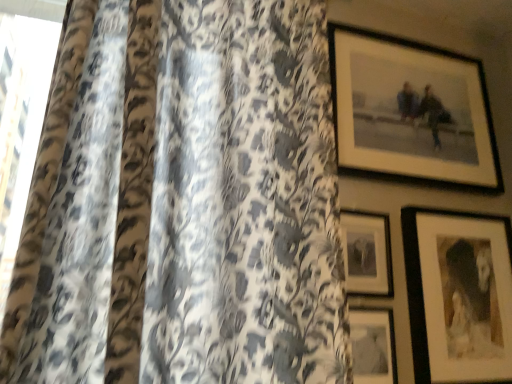
Identify the location of matte black picture frame at center, positioned as the third picture frame in bottom-to-top order. The image size is (512, 384). (367, 253).

From a real-world perspective, who is located lower, leopard print fabric at left or matte black picture frame at lower right, arranged as the 3th picture frame when viewed from the top?

From a 3D spatial view, matte black picture frame at lower right, arranged as the 3th picture frame when viewed from the top, is below.

Considering the positions of objects leopard print fabric at left and matte black picture frame at lower right, which is the 2th picture frame from bottom to top, in the image provided, who is more to the right, leopard print fabric at left or matte black picture frame at lower right, which is the 2th picture frame from bottom to top,?

matte black picture frame at lower right, which is the 2th picture frame from bottom to top.

Considering the sizes of objects leopard print fabric at left and matte black picture frame at lower right, arranged as the 3th picture frame when viewed from the top, in the image provided, who is smaller, leopard print fabric at left or matte black picture frame at lower right, arranged as the 3th picture frame when viewed from the top,?

matte black picture frame at lower right, arranged as the 3th picture frame when viewed from the top, is smaller.

Can you confirm if matte black picture frame at upper right, marked as the 4th picture frame in a bottom-to-top arrangement, is bigger than matte black picture frame at center, positioned as the third picture frame in bottom-to-top order?

Indeed, matte black picture frame at upper right, marked as the 4th picture frame in a bottom-to-top arrangement, has a larger size compared to matte black picture frame at center, positioned as the third picture frame in bottom-to-top order.

How many degrees apart are the facing directions of matte black picture frame at upper right, marked as the 4th picture frame in a bottom-to-top arrangement, and matte black picture frame at center, placed as the 2th picture frame when sorted from top to bottom?

The angle between the facing direction of matte black picture frame at upper right, marked as the 4th picture frame in a bottom-to-top arrangement, and the facing direction of matte black picture frame at center, placed as the 2th picture frame when sorted from top to bottom, is 4.52 degrees.

From the picture: Is matte black picture frame at upper right, marked as the 4th picture frame in a bottom-to-top arrangement, surrounding matte black picture frame at center, positioned as the third picture frame in bottom-to-top order?

No.

Is point (455, 158) positioned before point (377, 233)?

No, it is behind (377, 233).

Considering the sizes of objects matte black picture frame at lower center, positioned as the 4th picture frame in top-to-bottom order, and matte black picture frame at center, placed as the 2th picture frame when sorted from top to bottom, in the image provided, who is bigger, matte black picture frame at lower center, positioned as the 4th picture frame in top-to-bottom order, or matte black picture frame at center, placed as the 2th picture frame when sorted from top to bottom,?

Bigger between the two is matte black picture frame at center, placed as the 2th picture frame when sorted from top to bottom.

Is point (375, 324) positioned in front of point (361, 286)?

That is True.

Is matte black picture frame at center, placed as the 2th picture frame when sorted from top to bottom, surrounded by matte black picture frame at lower center, the 1th picture frame when ordered from bottom to top?

No, matte black picture frame at center, placed as the 2th picture frame when sorted from top to bottom, is not a part of matte black picture frame at lower center, the 1th picture frame when ordered from bottom to top.

Can you confirm if matte black picture frame at lower center, positioned as the 4th picture frame in top-to-bottom order, is positioned to the left of matte black picture frame at center, positioned as the third picture frame in bottom-to-top order?

Yes, matte black picture frame at lower center, positioned as the 4th picture frame in top-to-bottom order, is to the left of matte black picture frame at center, positioned as the third picture frame in bottom-to-top order.

Relative to matte black picture frame at center, placed as the 2th picture frame when sorted from top to bottom, is matte black picture frame at lower right, arranged as the 3th picture frame when viewed from the top, in front or behind?

matte black picture frame at lower right, arranged as the 3th picture frame when viewed from the top, is positioned closer to the viewer than matte black picture frame at center, placed as the 2th picture frame when sorted from top to bottom.

Is matte black picture frame at center, placed as the 2th picture frame when sorted from top to bottom, surrounded by matte black picture frame at lower right, arranged as the 3th picture frame when viewed from the top?

Definitely not — matte black picture frame at center, placed as the 2th picture frame when sorted from top to bottom, is not inside matte black picture frame at lower right, arranged as the 3th picture frame when viewed from the top.

Is there a large distance between matte black picture frame at lower right, which is the 2th picture frame from bottom to top, and matte black picture frame at center, positioned as the third picture frame in bottom-to-top order?

No, matte black picture frame at lower right, which is the 2th picture frame from bottom to top, is in close proximity to matte black picture frame at center, positioned as the third picture frame in bottom-to-top order.

Would you say matte black picture frame at center, positioned as the third picture frame in bottom-to-top order, is to the left or to the right of matte black picture frame at lower right, which is the 2th picture frame from bottom to top, in the picture?

Clearly, matte black picture frame at center, positioned as the third picture frame in bottom-to-top order, is on the left of matte black picture frame at lower right, which is the 2th picture frame from bottom to top, in the image.

Does point (387, 275) appear closer or farther from the camera than point (429, 239)?

Point (387, 275).

From a real-world perspective, count 1st picture frames downward from the matte black picture frame at center, positioned as the third picture frame in bottom-to-top order, and point to it. Please provide its 2D coordinates.

[(459, 296)]

Is matte black picture frame at lower center, the 1th picture frame when ordered from bottom to top, far away from matte black picture frame at upper right, placed as the first picture frame when sorted from top to bottom?

Actually, matte black picture frame at lower center, the 1th picture frame when ordered from bottom to top, and matte black picture frame at upper right, placed as the first picture frame when sorted from top to bottom, are a little close together.

Would you say matte black picture frame at lower center, positioned as the 4th picture frame in top-to-bottom order, is to the left or to the right of matte black picture frame at upper right, marked as the 4th picture frame in a bottom-to-top arrangement, in the picture?

In the image, matte black picture frame at lower center, positioned as the 4th picture frame in top-to-bottom order, appears on the left side of matte black picture frame at upper right, marked as the 4th picture frame in a bottom-to-top arrangement.

Who is shorter, matte black picture frame at lower center, positioned as the 4th picture frame in top-to-bottom order, or matte black picture frame at upper right, marked as the 4th picture frame in a bottom-to-top arrangement?

matte black picture frame at lower center, positioned as the 4th picture frame in top-to-bottom order, is shorter.

Which object is closer to the camera taking this photo, matte black picture frame at lower center, the 1th picture frame when ordered from bottom to top, or matte black picture frame at upper right, placed as the first picture frame when sorted from top to bottom?

matte black picture frame at lower center, the 1th picture frame when ordered from bottom to top.

Considering the sizes of objects matte black picture frame at center, placed as the 2th picture frame when sorted from top to bottom, and matte black picture frame at upper right, placed as the first picture frame when sorted from top to bottom, in the image provided, who is taller, matte black picture frame at center, placed as the 2th picture frame when sorted from top to bottom, or matte black picture frame at upper right, placed as the first picture frame when sorted from top to bottom,?

With more height is matte black picture frame at upper right, placed as the first picture frame when sorted from top to bottom.

From the image's perspective, relative to matte black picture frame at upper right, marked as the 4th picture frame in a bottom-to-top arrangement, is matte black picture frame at center, positioned as the third picture frame in bottom-to-top order, above or below?

Clearly, from the image's perspective, matte black picture frame at center, positioned as the third picture frame in bottom-to-top order, is below matte black picture frame at upper right, marked as the 4th picture frame in a bottom-to-top arrangement.

Which picture frame is the 1st one when counting from the right side of the matte black picture frame at center, positioned as the third picture frame in bottom-to-top order? Please provide its 2D coordinates.

[(411, 110)]

Find the location of a particular element. curtain in front of the matte black picture frame at lower right, arranged as the 3th picture frame when viewed from the top is located at coordinates (183, 202).

Where is `picture frame that is above the matte black picture frame at center, placed as the 2th picture frame when sorted from top to bottom (from a real-world perspective)`? picture frame that is above the matte black picture frame at center, placed as the 2th picture frame when sorted from top to bottom (from a real-world perspective) is located at coordinates (411, 110).

Looking at the image, which one is located closer to matte black picture frame at lower right, arranged as the 3th picture frame when viewed from the top, leopard print fabric at left or matte black picture frame at upper right, marked as the 4th picture frame in a bottom-to-top arrangement?

Among the two, matte black picture frame at upper right, marked as the 4th picture frame in a bottom-to-top arrangement, is located nearer to matte black picture frame at lower right, arranged as the 3th picture frame when viewed from the top.

Considering their positions, is matte black picture frame at center, positioned as the third picture frame in bottom-to-top order, positioned further to matte black picture frame at lower right, which is the 2th picture frame from bottom to top, than matte black picture frame at upper right, marked as the 4th picture frame in a bottom-to-top arrangement?

Based on the image, matte black picture frame at upper right, marked as the 4th picture frame in a bottom-to-top arrangement, appears to be further to matte black picture frame at lower right, which is the 2th picture frame from bottom to top.

Based on their spatial positions, is matte black picture frame at lower center, positioned as the 4th picture frame in top-to-bottom order, or matte black picture frame at upper right, placed as the first picture frame when sorted from top to bottom, further from leopard print fabric at left?

matte black picture frame at lower center, positioned as the 4th picture frame in top-to-bottom order.

Estimate the real-world distances between objects in this image. Which object is further from matte black picture frame at center, placed as the 2th picture frame when sorted from top to bottom, matte black picture frame at lower right, which is the 2th picture frame from bottom to top, or leopard print fabric at left?

Based on the image, leopard print fabric at left appears to be further to matte black picture frame at center, placed as the 2th picture frame when sorted from top to bottom.

From the image, which object appears to be farther from leopard print fabric at left, matte black picture frame at center, positioned as the third picture frame in bottom-to-top order, or matte black picture frame at lower center, the 1th picture frame when ordered from bottom to top?

matte black picture frame at lower center, the 1th picture frame when ordered from bottom to top, is further to leopard print fabric at left.

In the scene shown: Based on their spatial positions, is matte black picture frame at lower right, arranged as the 3th picture frame when viewed from the top, or matte black picture frame at upper right, marked as the 4th picture frame in a bottom-to-top arrangement, closer to leopard print fabric at left?

The object closer to leopard print fabric at left is matte black picture frame at upper right, marked as the 4th picture frame in a bottom-to-top arrangement.

Considering their positions, is matte black picture frame at lower center, the 1th picture frame when ordered from bottom to top, positioned closer to matte black picture frame at upper right, marked as the 4th picture frame in a bottom-to-top arrangement, than leopard print fabric at left?

leopard print fabric at left.

Estimate the real-world distances between objects in this image. Which object is closer to matte black picture frame at lower right, which is the 2th picture frame from bottom to top, matte black picture frame at upper right, marked as the 4th picture frame in a bottom-to-top arrangement, or matte black picture frame at center, placed as the 2th picture frame when sorted from top to bottom?

The object closer to matte black picture frame at lower right, which is the 2th picture frame from bottom to top, is matte black picture frame at center, placed as the 2th picture frame when sorted from top to bottom.

Locate an element on the screen. This screenshot has height=384, width=512. picture frame between matte black picture frame at upper right, placed as the first picture frame when sorted from top to bottom, and matte black picture frame at lower right, arranged as the 3th picture frame when viewed from the top, from top to bottom is located at coordinates (367, 253).

Image resolution: width=512 pixels, height=384 pixels. In order to click on curtain that lies between matte black picture frame at upper right, placed as the first picture frame when sorted from top to bottom, and matte black picture frame at lower center, the 1th picture frame when ordered from bottom to top, from top to bottom in this screenshot , I will do `click(183, 202)`.